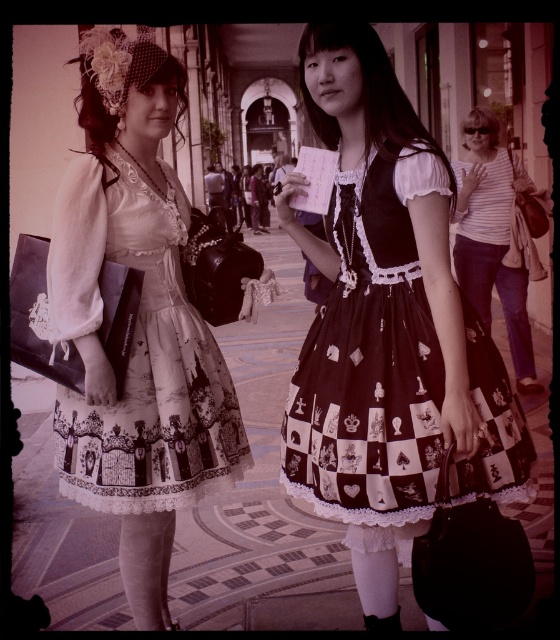
Consider the image. How much distance is there between black satin dress at center and white lace dress at center?

black satin dress at center and white lace dress at center are 1.54 meters apart.

Is black satin dress at center positioned behind white lace dress at center?

No, black satin dress at center is closer to the viewer.

What do you see at coordinates (370, 358) in the screenshot?
I see `black satin dress at center` at bounding box center [370, 358].

Identify the location of black satin dress at center. (370, 358).

Between white lace dress at center and white striped shirt at right, which one appears on the left side from the viewer's perspective?

Positioned to the left is white lace dress at center.

Can you confirm if white lace dress at center is positioned to the left of white striped shirt at right?

Yes, white lace dress at center is to the left of white striped shirt at right.

Identify the location of white lace dress at center. Image resolution: width=560 pixels, height=640 pixels. (138, 353).

Between black satin dress at center and white striped shirt at right, which one appears on the left side from the viewer's perspective?

black satin dress at center

Is point (410, 259) in front of point (477, 220)?

That is True.

What do you see at coordinates (370, 358) in the screenshot? I see `black satin dress at center` at bounding box center [370, 358].

Locate an element on the screen. black satin dress at center is located at coordinates (370, 358).